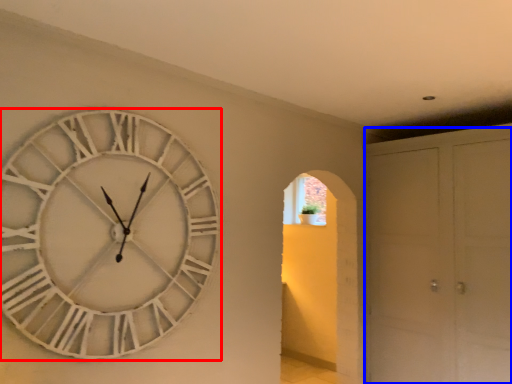
Question: Which of the following is the farthest to the observer, wall clock (highlighted by a red box) or glass door (highlighted by a blue box)?

Choices:
 (A) wall clock
 (B) glass door

Answer: (B)